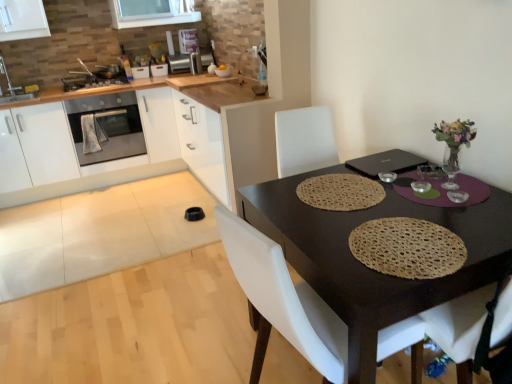
I want to click on free space to the right of woven beige placemat at table center, so click(479, 220).